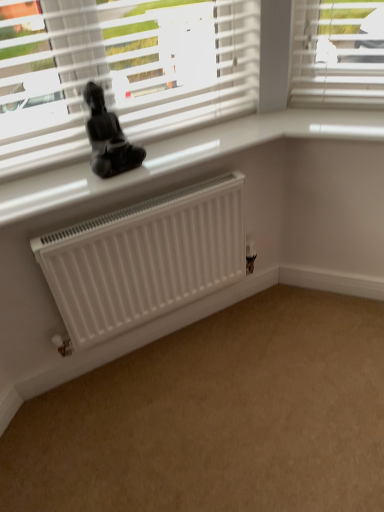
Image resolution: width=384 pixels, height=512 pixels. What are the coordinates of `free space above white glossy window sill at upper center (from a real-world perspective)` in the screenshot? It's located at (143, 155).